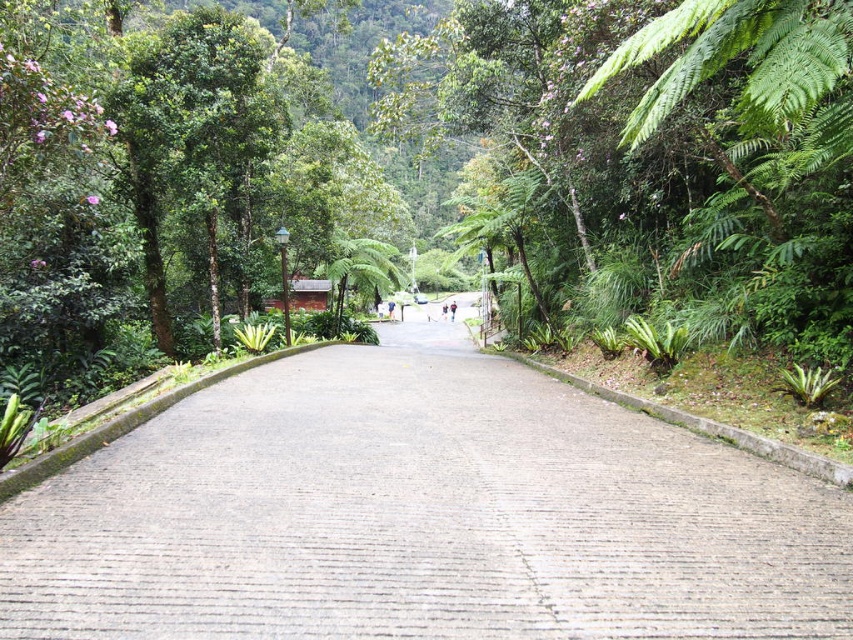
Which is above, gray concrete path at center or light brown skin at center?

light brown skin at center is above.

At what (x,y) coordinates should I click in order to perform the action: click on gray concrete path at center. Please return your answer as a coordinate pair (x, y). Looking at the image, I should click on (421, 515).

Between point (537, 497) and point (450, 314), which one is positioned in front?

Point (537, 497) is more forward.

This screenshot has height=640, width=853. Find the location of `gray concrete path at center`. gray concrete path at center is located at coordinates (421, 515).

This screenshot has height=640, width=853. What are the coordinates of `gray concrete path at center` in the screenshot? It's located at (421, 515).

I want to click on gray concrete path at center, so click(421, 515).

Between light brown skin at center and blue denim jeans at center, which one has less height?

Standing shorter between the two is blue denim jeans at center.

Is light brown skin at center to the right of blue denim jeans at center from the viewer's perspective?

Correct, you'll find light brown skin at center to the right of blue denim jeans at center.

This screenshot has width=853, height=640. Describe the element at coordinates (451, 308) in the screenshot. I see `light brown skin at center` at that location.

Find the location of a particular element. This screenshot has width=853, height=640. light brown skin at center is located at coordinates (451, 308).